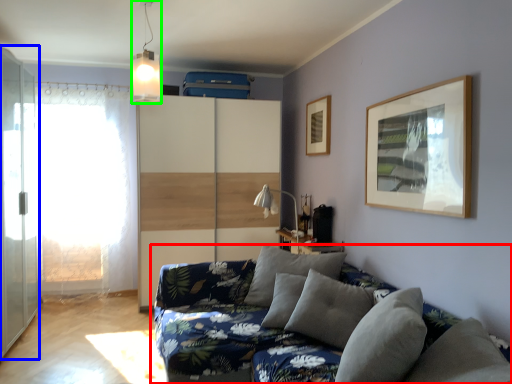
Question: Estimate the real-world distances between objects in this image. Which object is closer to studio couch (highlighted by a red box), screen door (highlighted by a blue box) or light fixture (highlighted by a green box)?

Choices:
 (A) screen door
 (B) light fixture

Answer: (A)